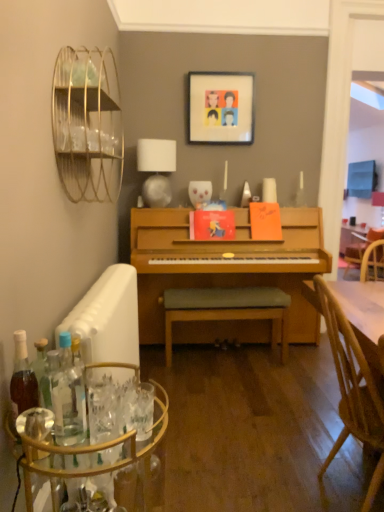
This screenshot has height=512, width=384. Identify the location of free point above matte plastic picture frame at upper center (from a real-world perspective). (229, 69).